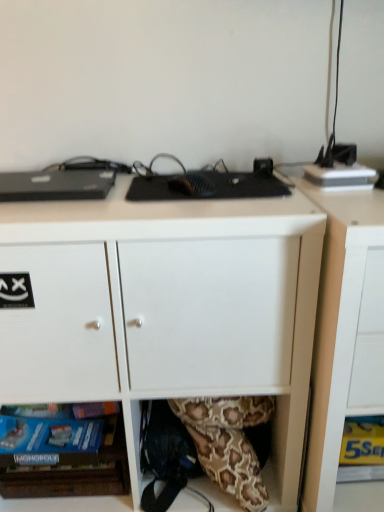
Question: Considering the relative sizes of yellow paper at lower right and white matte desk at center in the image provided, is yellow paper at lower right smaller than white matte desk at center?

Choices:
 (A) yes
 (B) no

Answer: (A)

Question: Does yellow paper at lower right appear on the right side of white matte desk at center?

Choices:
 (A) yes
 (B) no

Answer: (A)

Question: Can you see yellow paper at lower right touching white matte desk at center?

Choices:
 (A) yes
 (B) no

Answer: (B)

Question: Can you confirm if yellow paper at lower right is thinner than white matte desk at center?

Choices:
 (A) no
 (B) yes

Answer: (B)

Question: Does yellow paper at lower right come behind white matte desk at center?

Choices:
 (A) no
 (B) yes

Answer: (B)

Question: Considering the relative sizes of yellow paper at lower right and white matte desk at center in the image provided, is yellow paper at lower right taller than white matte desk at center?

Choices:
 (A) yes
 (B) no

Answer: (B)

Question: Does wooden board games at lower left come behind white matte desk at center?

Choices:
 (A) no
 (B) yes

Answer: (B)

Question: Is wooden board games at lower left next to white matte desk at center?

Choices:
 (A) yes
 (B) no

Answer: (B)

Question: Is wooden board games at lower left thinner than white matte desk at center?

Choices:
 (A) yes
 (B) no

Answer: (A)

Question: From a real-world perspective, is wooden board games at lower left under white matte desk at center?

Choices:
 (A) no
 (B) yes

Answer: (B)

Question: Would you say wooden board games at lower left is a long distance from white matte desk at center?

Choices:
 (A) yes
 (B) no

Answer: (B)

Question: Is wooden board games at lower left smaller than white matte desk at center?

Choices:
 (A) yes
 (B) no

Answer: (A)

Question: From the image's perspective, is yellow paper at lower right located beneath matte white cabinet at lower right?

Choices:
 (A) yes
 (B) no

Answer: (A)